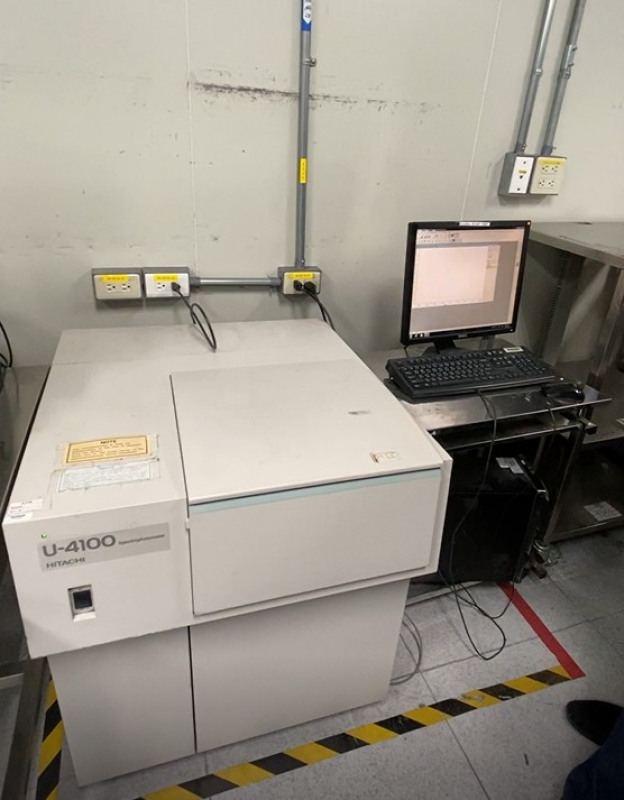
Where is `computer screen`? The width and height of the screenshot is (624, 800). computer screen is located at coordinates (483, 280).